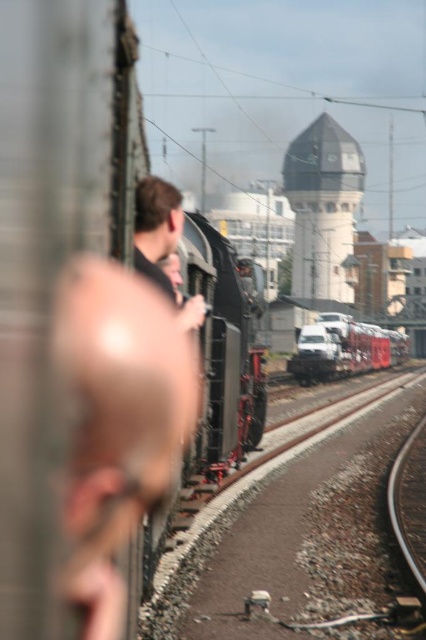
You are a photographer standing at the railway station and want to capture a photo of the white glossy truck at center and the smooth brown hair at center. Which object is located to the right of the other?

The white glossy truck at center is positioned on the right side of smooth brown hair at center.

You are standing at the entrance of the railway station and want to locate the white glossy truck at center. According to the coordinates provided, where should you look?

The white glossy truck at center is located at coordinates point (x=344, y=348), so you should look towards the lower middle area of the scene.

You are a delivery driver who needs to load a package onto the white glossy truck at center. You see the smooth brown hair at center nearby. Which object is bigger in size?

The white glossy truck at center is larger in size compared to the smooth brown hair at center.